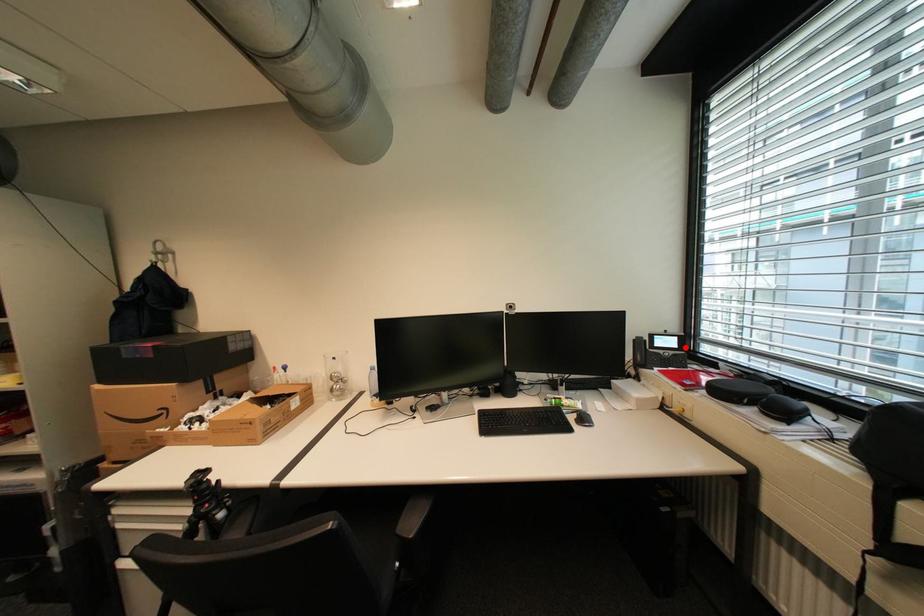
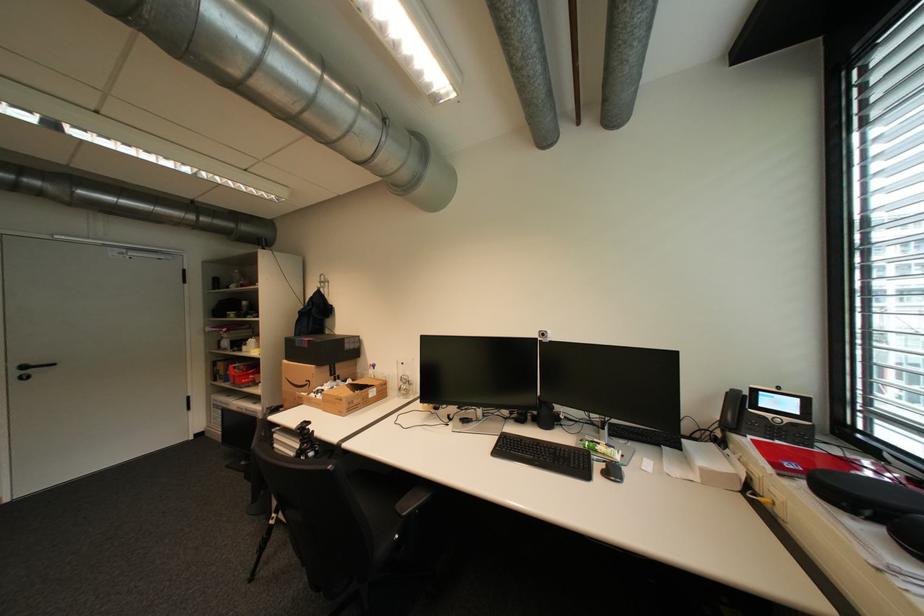
Question: I am providing you with two images of the same scene from different viewpoints. A red point is shown in image1. For the corresponding object point in image2, is it positioned nearer or farther from the camera?

Choices:
 (A) Nearer
 (B) Farther

Answer: (A)